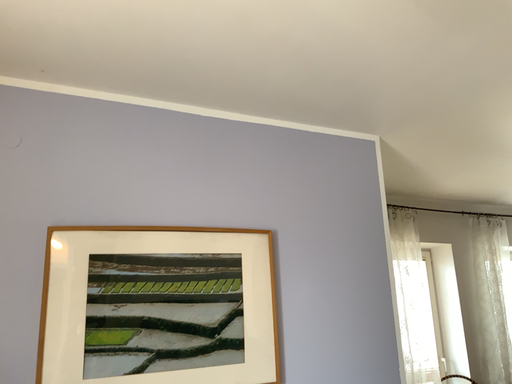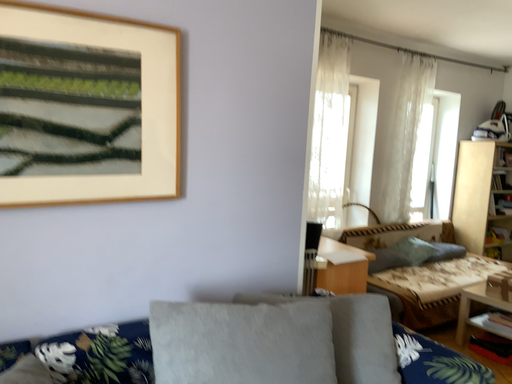
Question: Which way did the camera rotate in the video?

Choices:
 (A) rotated upward
 (B) rotated downward

Answer: (B)